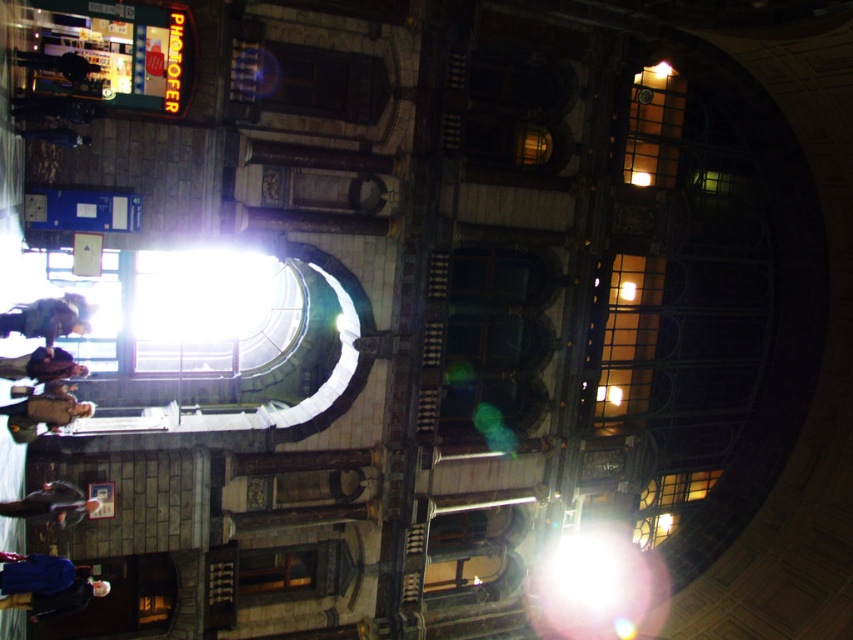
Question: From the image, what is the correct spatial relationship of dark brown leather jacket at lower left in relation to matte black jacket at lower left?

Choices:
 (A) below
 (B) above

Answer: (B)

Question: Which point is farther from the camera taking this photo?

Choices:
 (A) (28, 588)
 (B) (39, 358)
 (C) (73, 328)

Answer: (C)

Question: Can you confirm if matte black jacket at lower left is bigger than brown leather jacket at lower left?

Choices:
 (A) yes
 (B) no

Answer: (B)

Question: Which object is positioned closest to the matte brown coat at lower left?

Choices:
 (A) dark brown leather jacket at lower left
 (B) matte black jacket at lower left
 (C) dark blue coat at lower left
 (D) brown leather jacket at lower left

Answer: (A)

Question: Which of the following is the farthest from the observer?

Choices:
 (A) (45, 378)
 (B) (83, 602)
 (C) (33, 493)
 (D) (93, 408)

Answer: (D)

Question: Does dark brown leather jacket at lower left appear on the left side of matte black jacket at lower left?

Choices:
 (A) yes
 (B) no

Answer: (A)